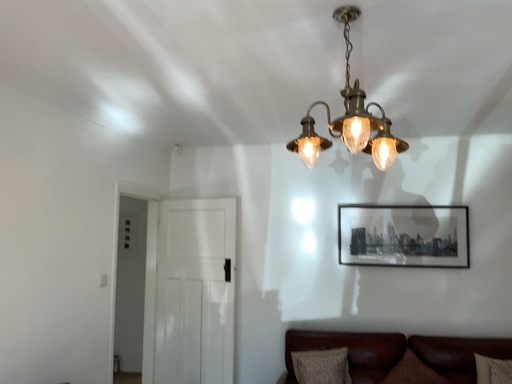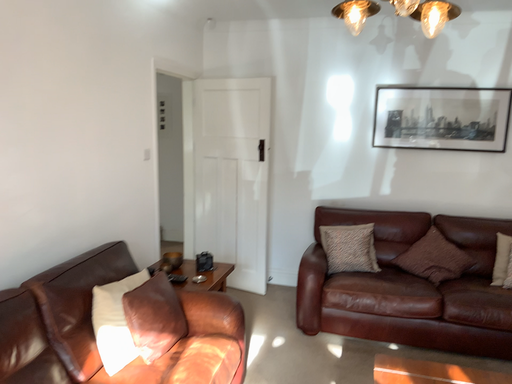
Question: Which way did the camera rotate in the video?

Choices:
 (A) rotated upward
 (B) rotated downward

Answer: (B)